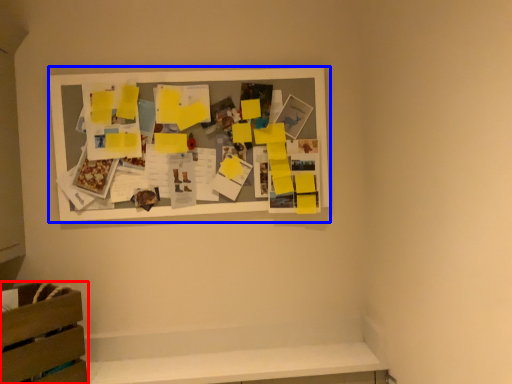
Question: Which object appears closest to the camera in this image, furniture (highlighted by a red box) or picture frame (highlighted by a blue box)?

Choices:
 (A) furniture
 (B) picture frame

Answer: (A)